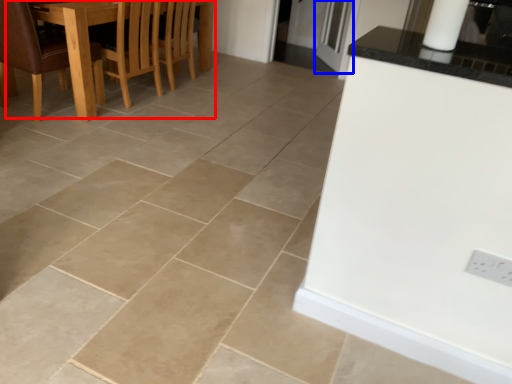
Question: Among these objects, which one is farthest to the camera, kitchen & dining room table (highlighted by a red box) or glass door (highlighted by a blue box)?

Choices:
 (A) kitchen & dining room table
 (B) glass door

Answer: (B)